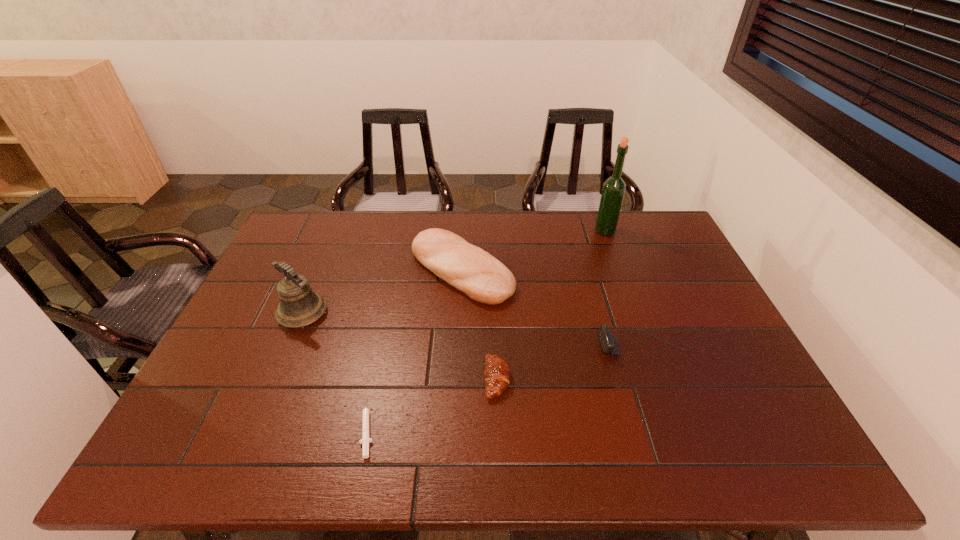
Locate an element on the screen. The height and width of the screenshot is (540, 960). vacant area that lies between the fourth shortest object and the third shortest object is located at coordinates (552, 308).

Where is `free space between the fourth shortest object and the syringe`? free space between the fourth shortest object and the syringe is located at coordinates (415, 348).

The image size is (960, 540). What are the coordinates of `vacant space in between the fifth shortest object and the fourth shortest object` in the screenshot? It's located at (382, 292).

Locate an element on the screen. empty location between the bread and the farthest object is located at coordinates (533, 251).

Identify the location of empty location between the fifth tallest object and the bread. Image resolution: width=960 pixels, height=540 pixels. (479, 325).

Image resolution: width=960 pixels, height=540 pixels. Find the location of `blank region between the second shortest object and the tallest object`. blank region between the second shortest object and the tallest object is located at coordinates (551, 305).

At what (x,y) coordinates should I click in order to perform the action: click on empty location between the crescent roll and the bread. Please return your answer as a coordinate pair (x, y). This screenshot has width=960, height=540. Looking at the image, I should click on (479, 325).

Where is `object that stands as the fifth closest to the leftmost object`? object that stands as the fifth closest to the leftmost object is located at coordinates (614, 187).

Locate which object ranks third in proximity to the crescent roll. Please provide its 2D coordinates. Your answer should be formatted as a tuple, i.e. [(x, y)], where the tuple contains the x and y coordinates of a point satisfying the conditions above.

[(365, 440)]

The image size is (960, 540). What are the coordinates of `vacant region that satisfies the following two spatial constraints: 1. on the front side of the fifth tallest object; 2. on the right side of the bell` in the screenshot? It's located at (276, 379).